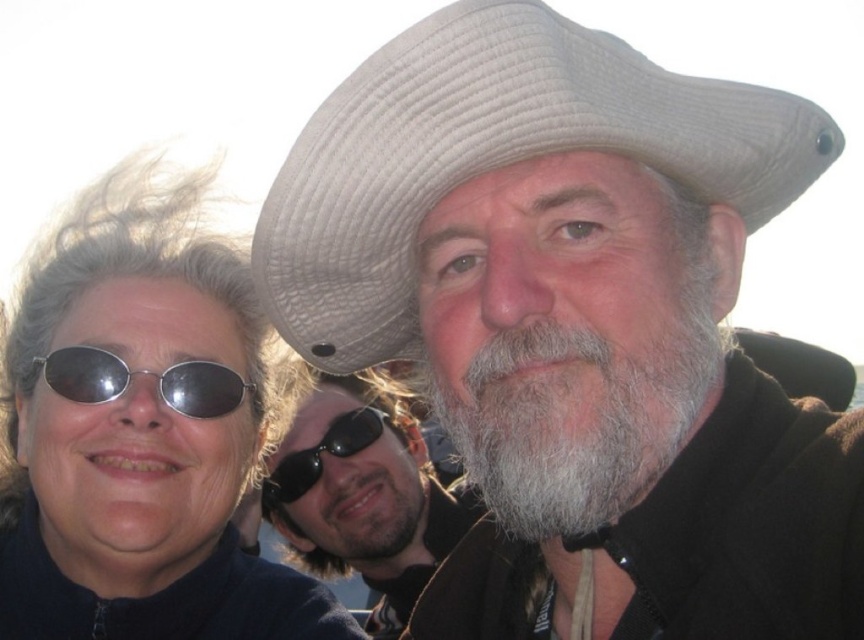
Question: Is graywoollybeard at center below black reflective sunglasses at center?

Choices:
 (A) yes
 (B) no

Answer: (B)

Question: Which of the following is the closest to the observer?

Choices:
 (A) (443, 35)
 (B) (102, 380)
 (C) (125, 586)
 (D) (291, 492)

Answer: (A)

Question: Considering the real-world distances, which object is farthest from the graywoollybeard at center?

Choices:
 (A) silver reflective sunglasses at upper left
 (B) matte black sunglasses at upper left
 (C) gray beard at center

Answer: (C)

Question: Does matte black sunglasses at upper left have a lesser width compared to white woven cowboy hat at upper center?

Choices:
 (A) no
 (B) yes

Answer: (A)

Question: Which object is closer to the camera taking this photo?

Choices:
 (A) graywoollybeard at center
 (B) white woven cowboy hat at upper center

Answer: (B)

Question: Is matte black sunglasses at upper left above black reflective sunglasses at center?

Choices:
 (A) yes
 (B) no

Answer: (A)